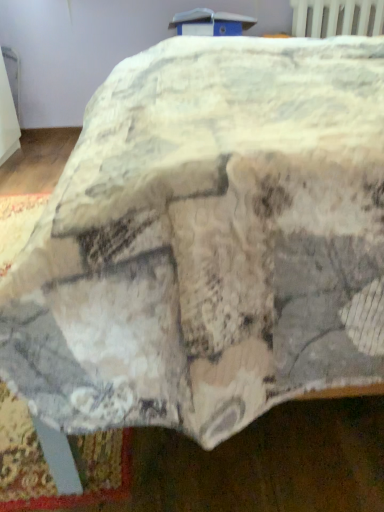
Question: Considering the relative sizes of white plastic table at upper center and white plastic radiator at upper right in the image provided, is white plastic table at upper center wider than white plastic radiator at upper right?

Choices:
 (A) yes
 (B) no

Answer: (A)

Question: From a real-world perspective, is white plastic table at upper center located higher than white plastic radiator at upper right?

Choices:
 (A) no
 (B) yes

Answer: (B)

Question: Is white plastic table at upper center bigger than white plastic radiator at upper right?

Choices:
 (A) no
 (B) yes

Answer: (B)

Question: Are white plastic table at upper center and white plastic radiator at upper right beside each other?

Choices:
 (A) yes
 (B) no

Answer: (B)

Question: Is white plastic table at upper center oriented towards white plastic radiator at upper right?

Choices:
 (A) yes
 (B) no

Answer: (B)

Question: Considering the relative sizes of white plastic table at upper center and white plastic radiator at upper right in the image provided, is white plastic table at upper center smaller than white plastic radiator at upper right?

Choices:
 (A) no
 (B) yes

Answer: (A)

Question: Is white plastic radiator at upper right not inside white plastic table at upper center?

Choices:
 (A) yes
 (B) no

Answer: (A)

Question: Can you confirm if white plastic radiator at upper right is positioned to the right of white plastic table at upper center?

Choices:
 (A) no
 (B) yes

Answer: (B)

Question: From the image's perspective, is white plastic radiator at upper right over white plastic table at upper center?

Choices:
 (A) no
 (B) yes

Answer: (B)

Question: From a real-world perspective, is white plastic radiator at upper right physically below white plastic table at upper center?

Choices:
 (A) yes
 (B) no

Answer: (A)

Question: Is white plastic radiator at upper right further to camera compared to white plastic table at upper center?

Choices:
 (A) yes
 (B) no

Answer: (A)

Question: Can you confirm if white plastic radiator at upper right is thinner than white plastic table at upper center?

Choices:
 (A) no
 (B) yes

Answer: (B)

Question: In terms of width, does white plastic radiator at upper right look wider or thinner when compared to white plastic table at upper center?

Choices:
 (A) wide
 (B) thin

Answer: (B)